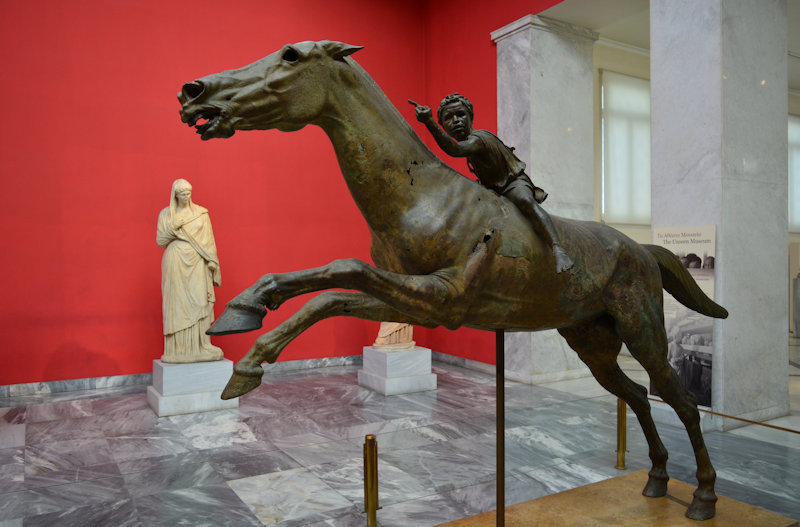
Find the location of a particular element. floor is located at coordinates (606, 495).